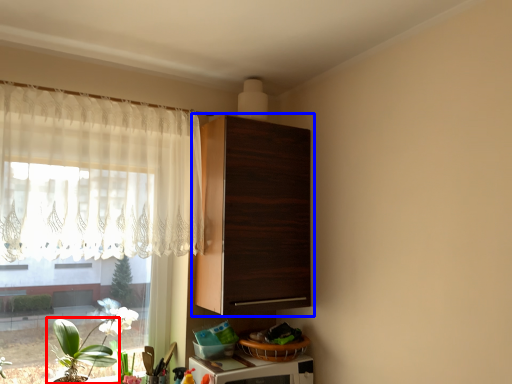
Question: Among these objects, which one is nearest to the camera, houseplant (highlighted by a red box) or cabinetry (highlighted by a blue box)?

Choices:
 (A) houseplant
 (B) cabinetry

Answer: (A)